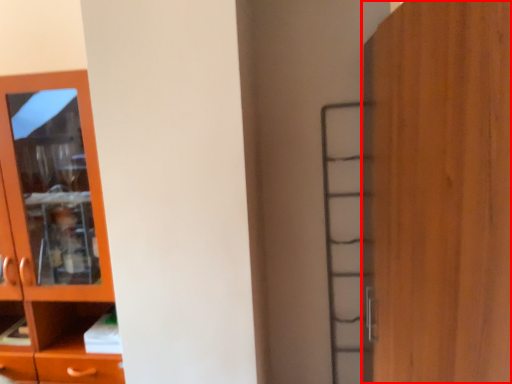
Question: Observing the image, what is the correct spatial positioning of door (annotated by the red box) in reference to cupboard?

Choices:
 (A) right
 (B) left

Answer: (A)